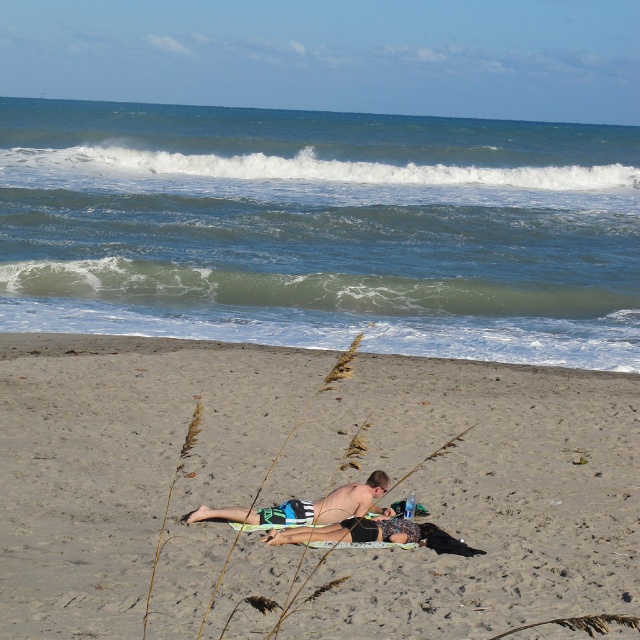
Who is higher up, tan skin man at center or printed fabric bikini at center?

tan skin man at center

Is tan skin man at center bigger than printed fabric bikini at center?

Correct, tan skin man at center is larger in size than printed fabric bikini at center.

Between point (381, 490) and point (426, 532), which one is positioned behind?

Positioned behind is point (381, 490).

I want to click on tan skin man at center, so coord(308,506).

Which of these two, sandy beach at lower center or tan skin man at center, stands shorter?

With less height is tan skin man at center.

Which is in front, point (106, 387) or point (358, 493)?

Point (358, 493) is more forward.

The image size is (640, 640). I want to click on sandy beach at lower center, so tap(477, 496).

Is tan skin man at center smaller than skinny tan man at center?

Incorrect, tan skin man at center is not smaller in size than skinny tan man at center.

Is point (300, 518) closer to viewer compared to point (364, 492)?

Yes, it is.

Is point (330, 500) farther from camera compared to point (376, 474)?

No, it is in front of (376, 474).

Image resolution: width=640 pixels, height=640 pixels. In order to click on tan skin man at center in this screenshot , I will do `click(308, 506)`.